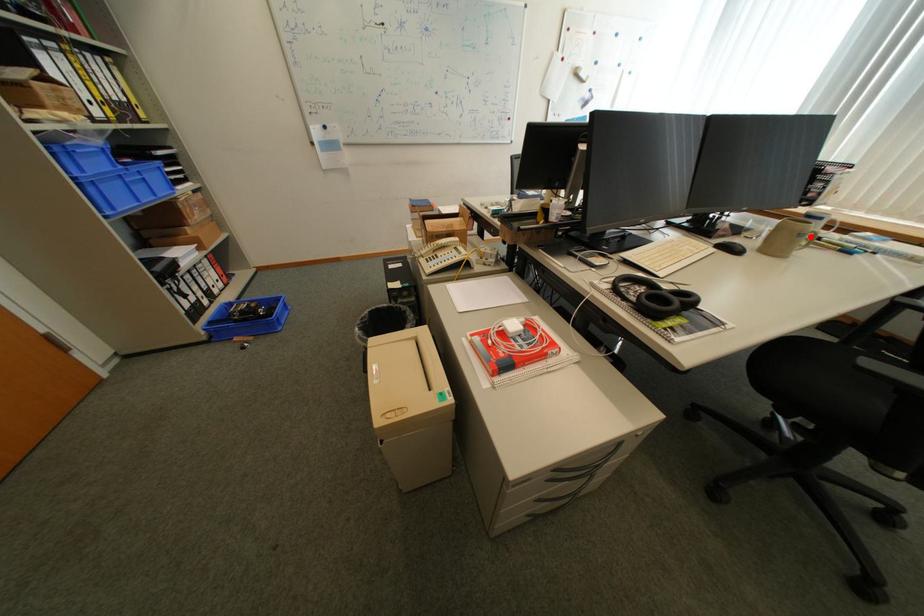
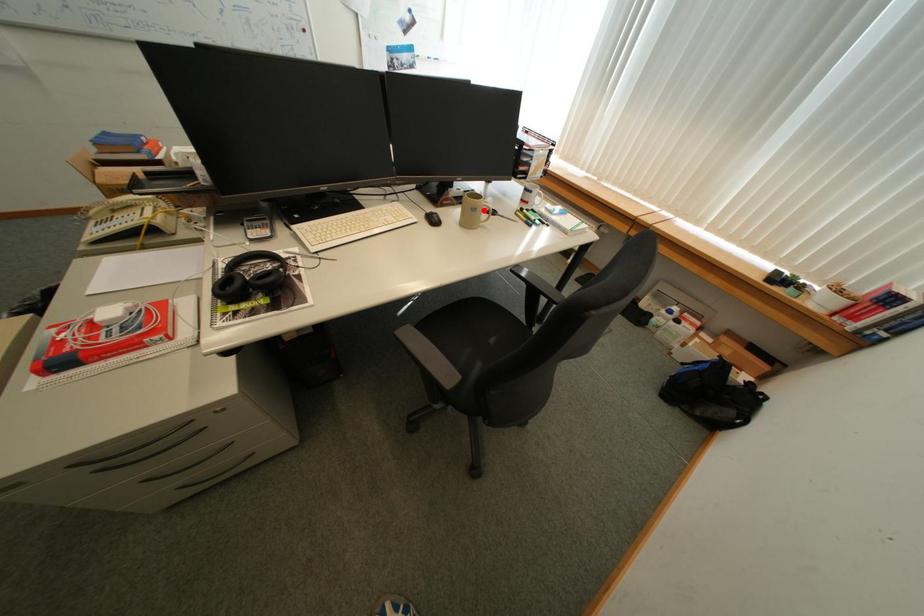
I am providing you with two images of the same scene from different viewpoints. A red point is marked on the first image and another point is marked on the second image. Is the marked point in image1 the same physical position as the marked point in image2?

Yes